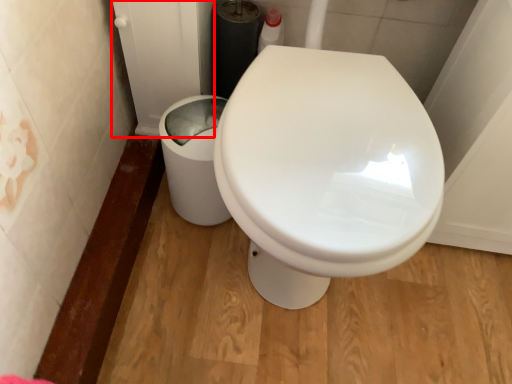
Question: Considering the relative positions of screen door (annotated by the red box) and porcelain in the image provided, where is screen door (annotated by the red box) located with respect to the staircase?

Choices:
 (A) right
 (B) left

Answer: (B)